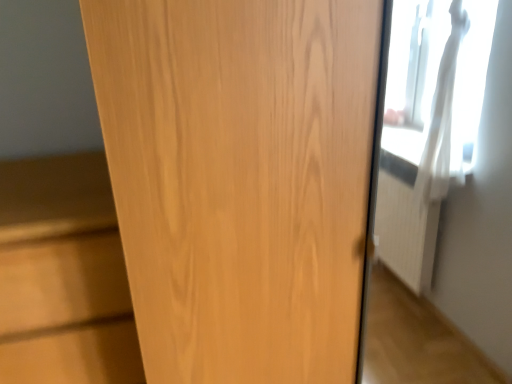
Question: From a real-world perspective, is wooden door at center physically below light wood cabinet at left?

Choices:
 (A) no
 (B) yes

Answer: (A)

Question: Can you confirm if wooden door at center is shorter than light wood cabinet at left?

Choices:
 (A) no
 (B) yes

Answer: (A)

Question: Can you confirm if wooden door at center is positioned to the left of light wood cabinet at left?

Choices:
 (A) no
 (B) yes

Answer: (A)

Question: Is light wood cabinet at left inside wooden door at center?

Choices:
 (A) yes
 (B) no

Answer: (B)

Question: Is there a large distance between wooden door at center and light wood cabinet at left?

Choices:
 (A) no
 (B) yes

Answer: (A)

Question: Is light wood cabinet at left at the back of wooden door at center?

Choices:
 (A) no
 (B) yes

Answer: (A)

Question: Does light wood cabinet at left touch wooden door at center?

Choices:
 (A) no
 (B) yes

Answer: (A)

Question: Is light wood cabinet at left at the left side of wooden door at center?

Choices:
 (A) yes
 (B) no

Answer: (A)

Question: From the image's perspective, is light wood cabinet at left below wooden door at center?

Choices:
 (A) yes
 (B) no

Answer: (A)

Question: Is light wood cabinet at left turned away from wooden door at center?

Choices:
 (A) yes
 (B) no

Answer: (B)

Question: Can you confirm if light wood cabinet at left is wider than wooden door at center?

Choices:
 (A) yes
 (B) no

Answer: (B)

Question: Would you say wooden door at center is part of light wood cabinet at left's contents?

Choices:
 (A) no
 (B) yes

Answer: (A)

Question: From their relative heights in the image, would you say wooden door at center is taller or shorter than light wood cabinet at left?

Choices:
 (A) tall
 (B) short

Answer: (A)